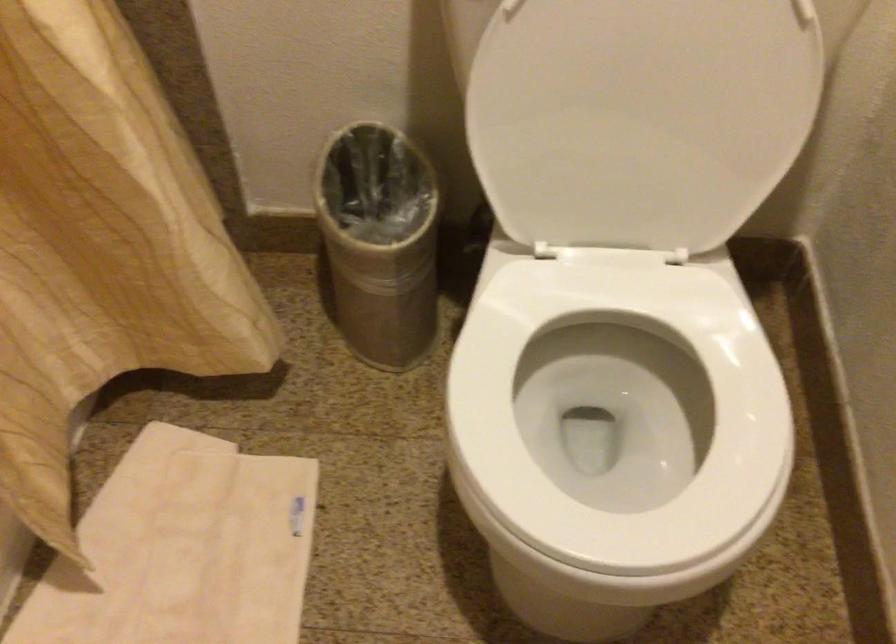
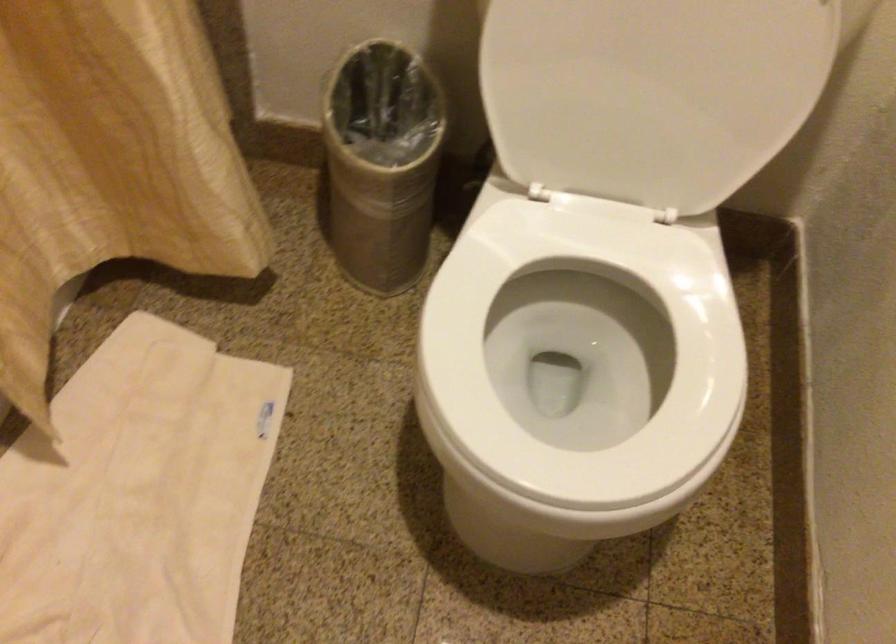
Which direction would the cameraman need to move to produce the second image?

The cameraman walked toward right, backward.